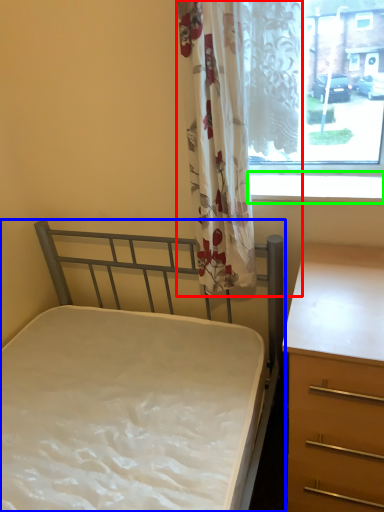
Question: Considering the real-world distances, which object is farthest from curtain (highlighted by a red box)? bed (highlighted by a blue box) or window sill (highlighted by a green box)?

Choices:
 (A) bed
 (B) window sill

Answer: (A)